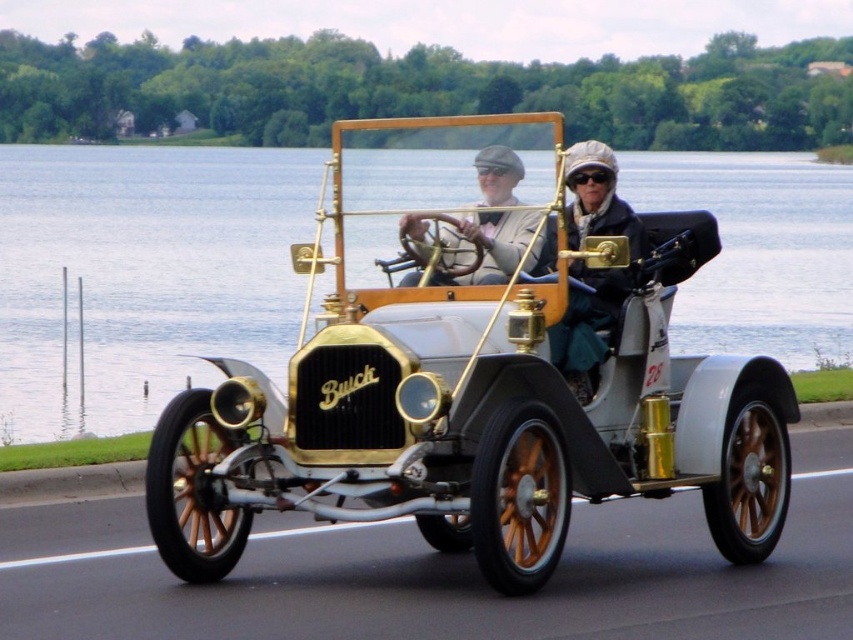
Question: Is white polished wood car at center closer to camera compared to matte black jacket at center?

Choices:
 (A) yes
 (B) no

Answer: (A)

Question: Which point is farther to the camera?

Choices:
 (A) white polished wood car at center
 (B) matte gold steering wheel at center

Answer: (B)

Question: Which object is farther from the camera taking this photo?

Choices:
 (A) matte black jacket at center
 (B) matte gold steering wheel at center

Answer: (B)

Question: Can you confirm if white polished wood car at center is wider than matte gold steering wheel at center?

Choices:
 (A) no
 (B) yes

Answer: (B)

Question: Is matte black jacket at center further to the viewer compared to matte gold steering wheel at center?

Choices:
 (A) yes
 (B) no

Answer: (B)

Question: Based on their relative distances, which object is nearer to the matte gold steering wheel at center?

Choices:
 (A) matte black jacket at center
 (B) white polished wood car at center

Answer: (A)